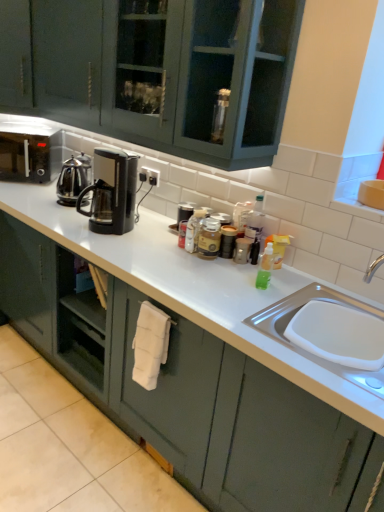
At what (x,y) coordinates should I click in order to perform the action: click on free location in front of polished stainless steel kettle at left, the 2th kitchen appliance positioned from the right. Please return your answer as a coordinate pair (x, y). This screenshot has width=384, height=512. Looking at the image, I should click on (54, 211).